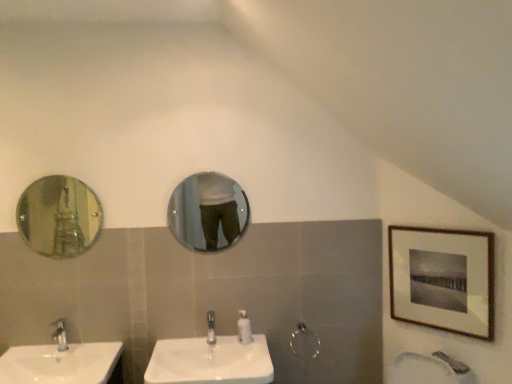
Question: Is wooden-framed print at upper right facing away from white glossy sink at center, which is the first sink from right to left?

Choices:
 (A) no
 (B) yes

Answer: (A)

Question: Is wooden-framed print at upper right not inside white glossy sink at center, which is the first sink from right to left?

Choices:
 (A) yes
 (B) no

Answer: (A)

Question: Considering the relative positions of wooden-framed print at upper right and white glossy sink at center, the second sink positioned from the left, in the image provided, is wooden-framed print at upper right behind white glossy sink at center, the second sink positioned from the left,?

Choices:
 (A) yes
 (B) no

Answer: (A)

Question: Considering the relative sizes of wooden-framed print at upper right and white glossy sink at center, the second sink positioned from the left, in the image provided, is wooden-framed print at upper right wider than white glossy sink at center, the second sink positioned from the left,?

Choices:
 (A) yes
 (B) no

Answer: (B)

Question: Does wooden-framed print at upper right have a lesser height compared to white glossy sink at center, the second sink positioned from the left?

Choices:
 (A) no
 (B) yes

Answer: (A)

Question: Based on their sizes in the image, would you say white glossy soap dispenser at center is bigger or smaller than white glossy sink at center, the second sink positioned from the left?

Choices:
 (A) big
 (B) small

Answer: (B)

Question: Is white glossy soap dispenser at center wider or thinner than white glossy sink at center, which is the first sink from right to left?

Choices:
 (A) wide
 (B) thin

Answer: (B)

Question: Would you say white glossy soap dispenser at center is inside or outside white glossy sink at center, which is the first sink from right to left?

Choices:
 (A) outside
 (B) inside

Answer: (A)

Question: Is point (247, 334) positioned closer to the camera than point (224, 347)?

Choices:
 (A) closer
 (B) farther

Answer: (A)

Question: From their relative heights in the image, would you say wooden-framed print at upper right is taller or shorter than silver metallic shower at center?

Choices:
 (A) tall
 (B) short

Answer: (A)

Question: In terms of width, does wooden-framed print at upper right look wider or thinner when compared to silver metallic shower at center?

Choices:
 (A) thin
 (B) wide

Answer: (B)

Question: Is point (401, 284) closer or farther from the camera than point (300, 354)?

Choices:
 (A) closer
 (B) farther

Answer: (A)

Question: Is wooden-framed print at upper right situated inside silver metallic shower at center or outside?

Choices:
 (A) inside
 (B) outside

Answer: (B)

Question: Is point (53, 236) closer or farther from the camera than point (458, 332)?

Choices:
 (A) farther
 (B) closer

Answer: (A)

Question: Is shiny silver mirror at left, the 2th mirror viewed from the right, taller or shorter than wooden-framed print at upper right?

Choices:
 (A) tall
 (B) short

Answer: (B)